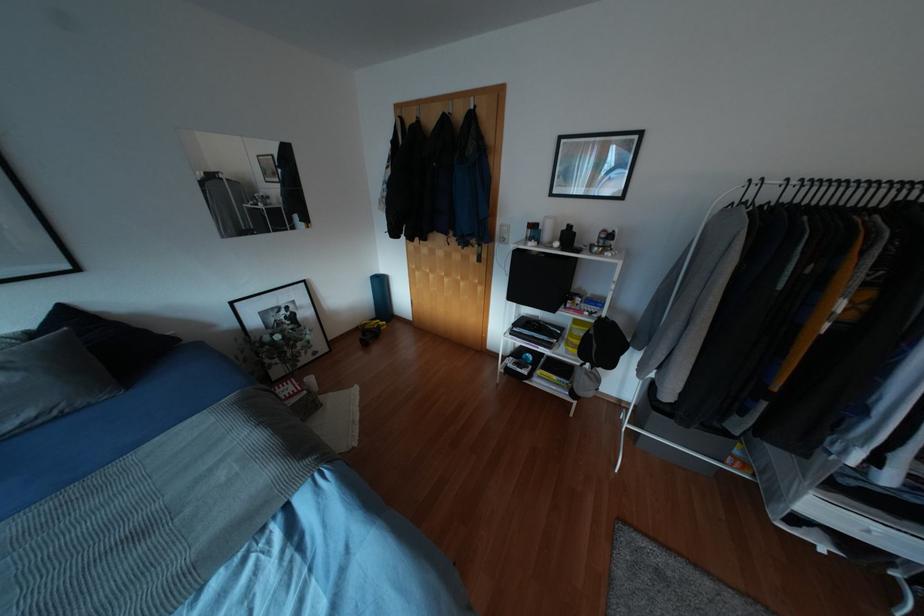
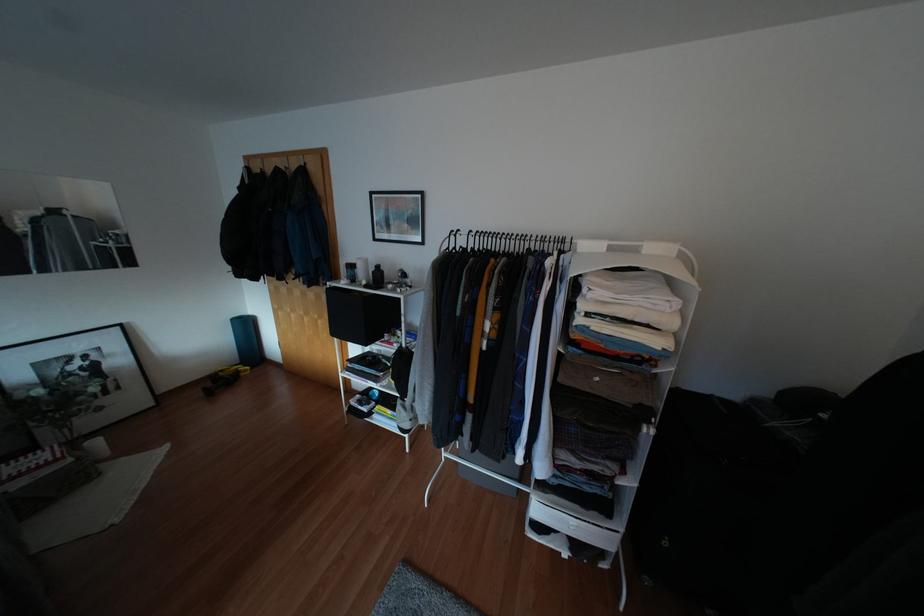
In the second image, find the point that corresponds to pixel 591 320 in the first image.

(394, 351)